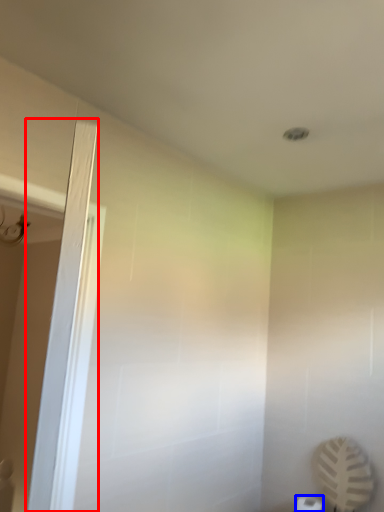
Question: Among these objects, which one is farthest to the camera, screen door (highlighted by a red box) or toilet paper (highlighted by a blue box)?

Choices:
 (A) screen door
 (B) toilet paper

Answer: (B)